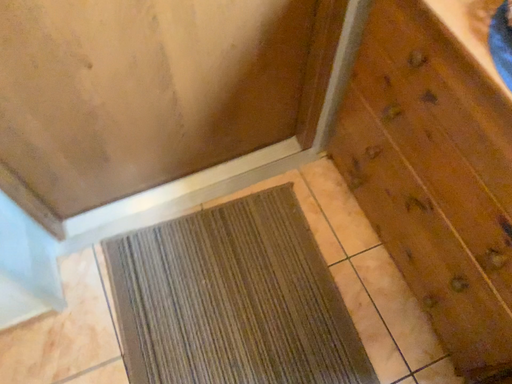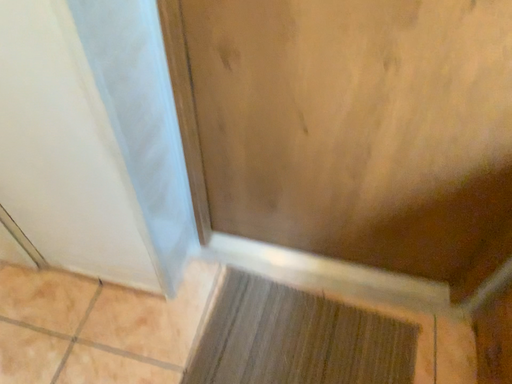
Question: Which way did the camera rotate in the video?

Choices:
 (A) rotated upward
 (B) rotated downward

Answer: (A)